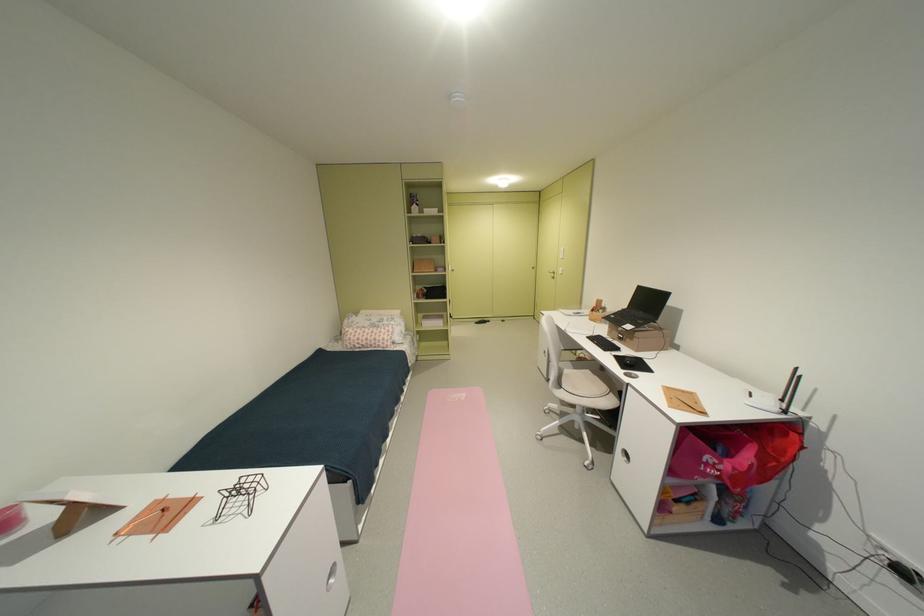
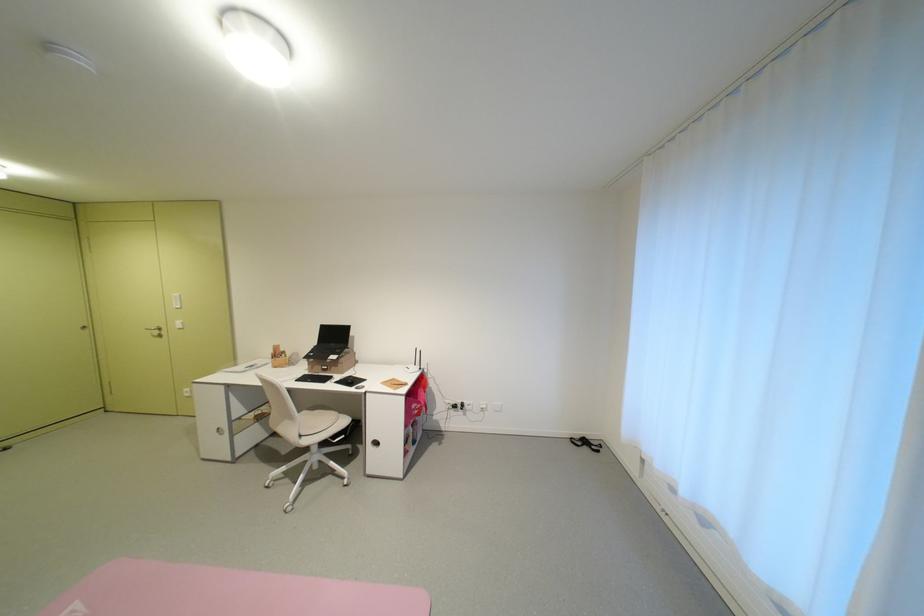
Where in the second image is the point corresponding to (x=636, y=309) from the first image?

(324, 345)